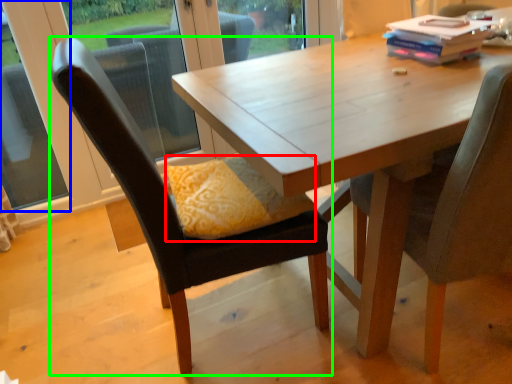
Question: Which is nearer to the pillow (highlighted by a red box)? window (highlighted by a blue box) or chair (highlighted by a green box).

Choices:
 (A) window
 (B) chair

Answer: (B)